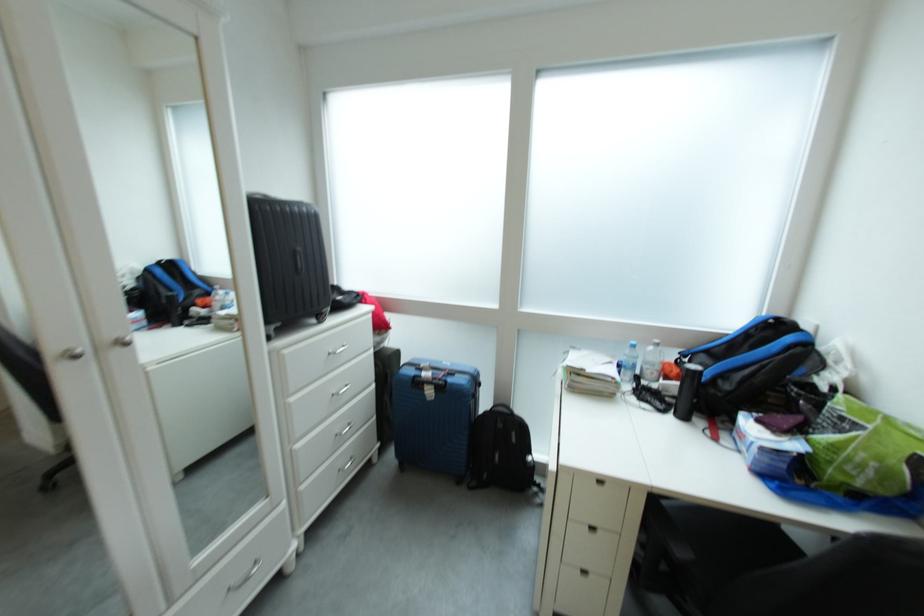
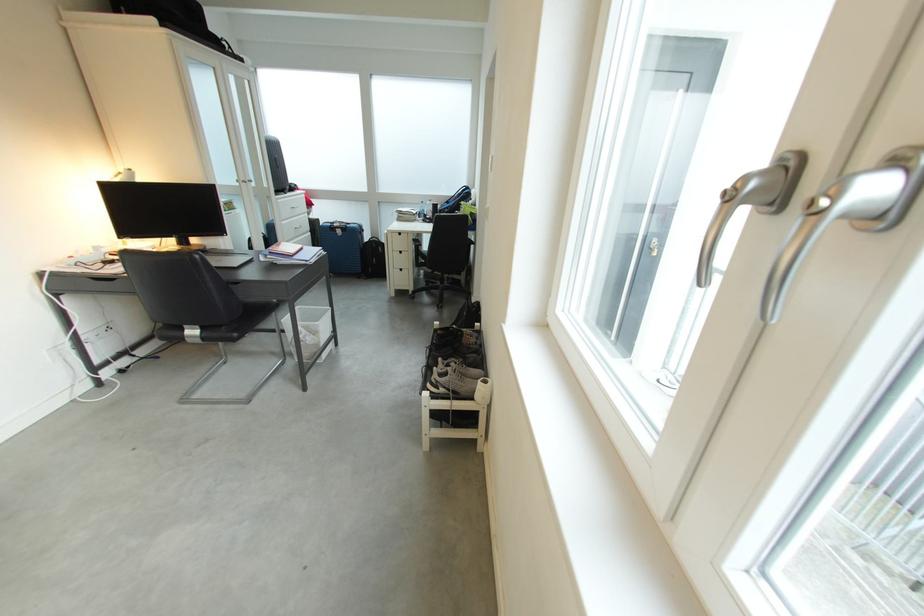
Find the pixel in the second image that matches (441,395) in the first image.

(350, 235)